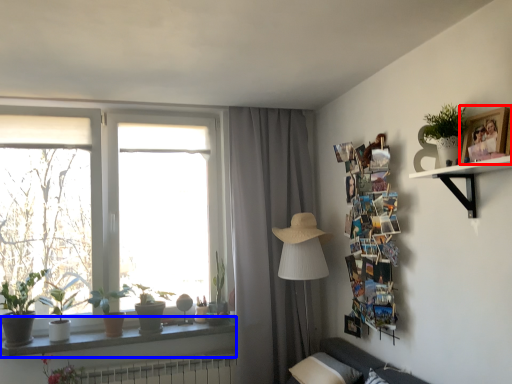
Question: Which of the following is the farthest to the observer, picture frame (highlighted by a red box) or window sill (highlighted by a blue box)?

Choices:
 (A) picture frame
 (B) window sill

Answer: (B)